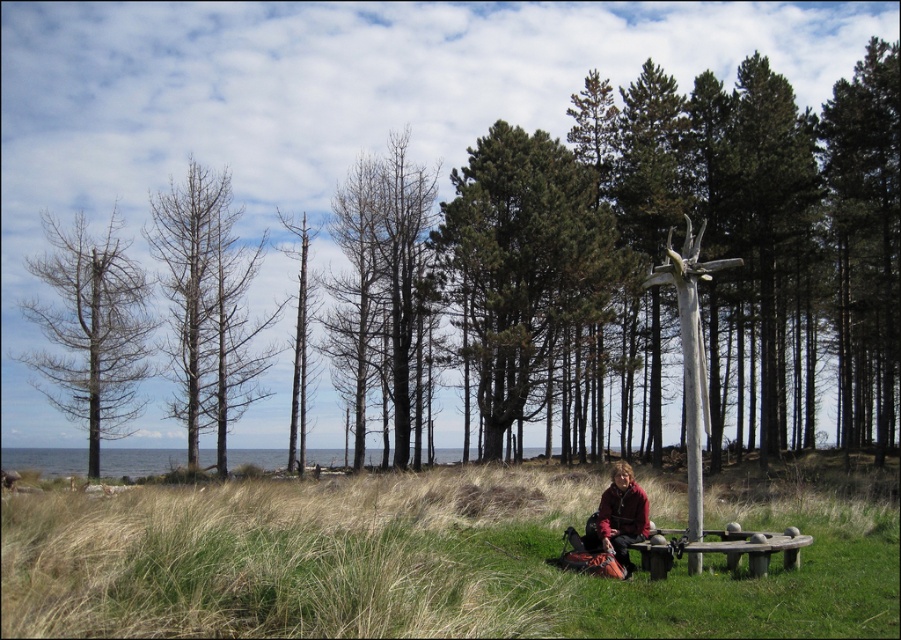
Question: Can you confirm if green coniferous trees at center is wider than bare wood trees at left?

Choices:
 (A) no
 (B) yes

Answer: (B)

Question: Based on their relative distances, which object is farther from the bare wood trees at left?

Choices:
 (A) bare wood tree at left
 (B) matte red jacket at lower center

Answer: (B)

Question: Which object is closer to the camera taking this photo?

Choices:
 (A) brown wood tree at center
 (B) bare wood tree at left

Answer: (A)

Question: Which point appears closest to the camera in this image?

Choices:
 (A) (228, 257)
 (B) (745, 230)

Answer: (B)

Question: Does brown wood tree at center have a larger size compared to green coniferous trees at center?

Choices:
 (A) no
 (B) yes

Answer: (B)

Question: Considering the relative positions of green grass at lower center and matte red jacket at lower center in the image provided, where is green grass at lower center located with respect to matte red jacket at lower center?

Choices:
 (A) right
 (B) left

Answer: (B)